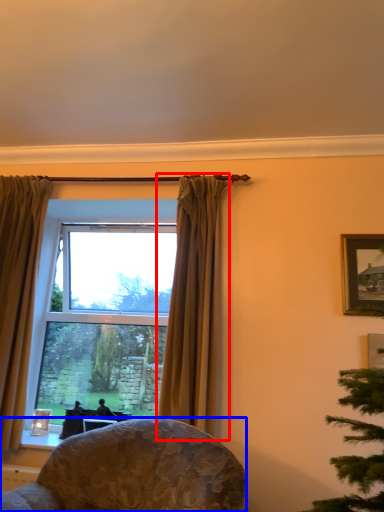
Question: Which point is further to the camera, curtain (highlighted by a red box) or chair (highlighted by a blue box)?

Choices:
 (A) curtain
 (B) chair

Answer: (A)